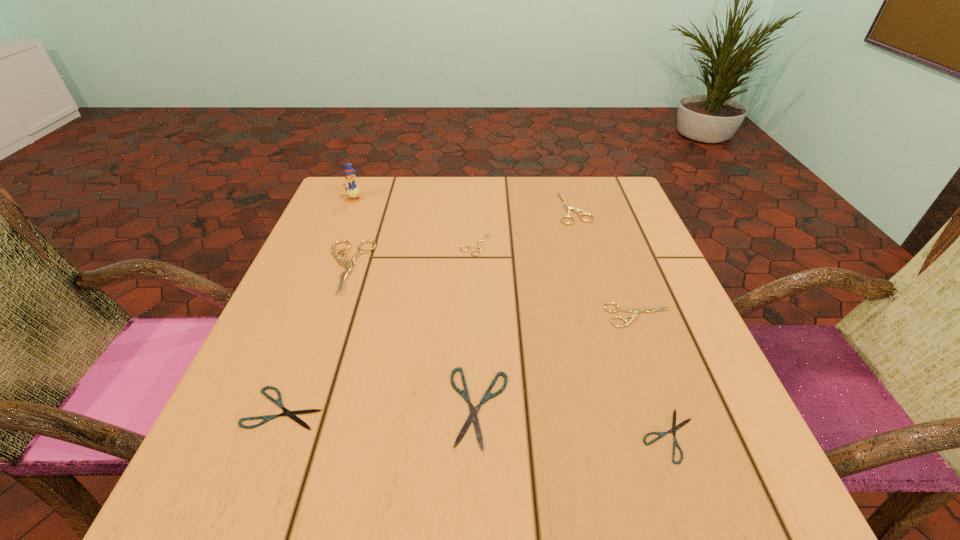
Identify the location of black shears identified as the second closest to the fourth nearest object. (464, 393).

Where is `free space that satisfies the following two spatial constraints: 1. on the face of the biggest beige shears, where the monocle is placed; 2. on the left side of the duckling`? This screenshot has width=960, height=540. free space that satisfies the following two spatial constraints: 1. on the face of the biggest beige shears, where the monocle is placed; 2. on the left side of the duckling is located at coordinates 326,267.

Locate an element on the screen. The height and width of the screenshot is (540, 960). vacant space that satisfies the following two spatial constraints: 1. on the front side of the second tallest shears; 2. on the right side of the fifth shortest shears is located at coordinates click(x=606, y=315).

Locate an element on the screen. The image size is (960, 540). vacant space that satisfies the following two spatial constraints: 1. on the face of the yellow duckling, where the monocle is placed; 2. on the left side of the second biggest black shears is located at coordinates (268, 408).

In order to click on free location that satisfies the following two spatial constraints: 1. on the front side of the farthest shears; 2. on the right side of the nearest beige shears in this screenshot , I will do `click(606, 315)`.

Locate an element on the screen. vacant space that satisfies the following two spatial constraints: 1. on the face of the yellow duckling, where the monocle is placed; 2. on the right side of the smallest beige shears is located at coordinates (335, 245).

This screenshot has height=540, width=960. Find the location of `free space that satisfies the following two spatial constraints: 1. on the face of the shortest object, where the monocle is placed; 2. on the left side of the duckling`. free space that satisfies the following two spatial constraints: 1. on the face of the shortest object, where the monocle is placed; 2. on the left side of the duckling is located at coordinates (257, 435).